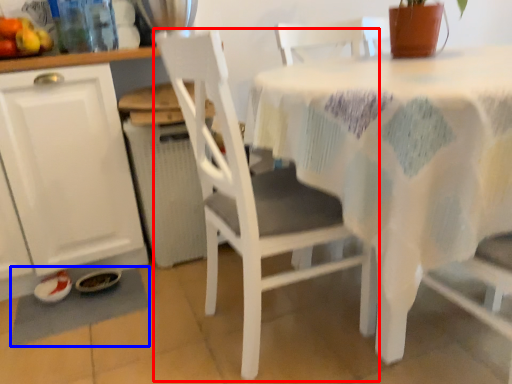
Question: Which object is further to the camera taking this photo, chair (highlighted by a red box) or place mat (highlighted by a blue box)?

Choices:
 (A) chair
 (B) place mat

Answer: (B)